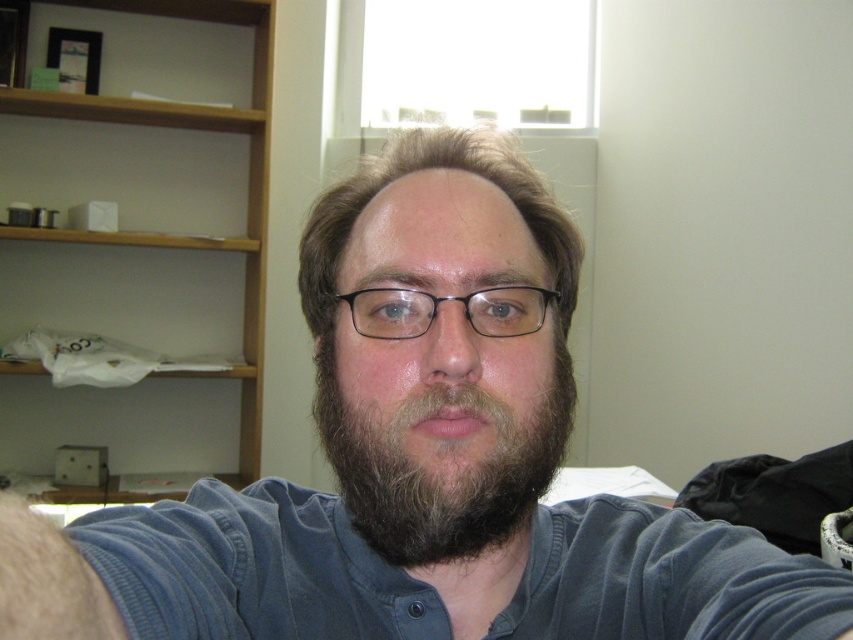
Based on the photo, you are trying to decide where to place a new large photo frame. You have two options in the image, the wooden bookshelf at upper left and the black plastic glasses at center. Which location would allow the frame to fit better?

The wooden bookshelf at upper left has a larger size compared to the black plastic glasses at center, so the photo frame would fit better on the wooden bookshelf at upper left.

You are a photographer adjusting the lighting for a portrait. You notice the dark brown fuzzy beard at center and the black plastic glasses at center in the frame. Which object is positioned lower in the image?

The dark brown fuzzy beard at center is located below the black plastic glasses at center, so the dark brown fuzzy beard at center is positioned lower in the image.

You are taking a photo of two points in the scene. The first point is at coordinates point (531, 424) and the second is at point (338, 298). Which point is closer to the camera?

Point (531, 424) is closer to the camera than point (338, 298).